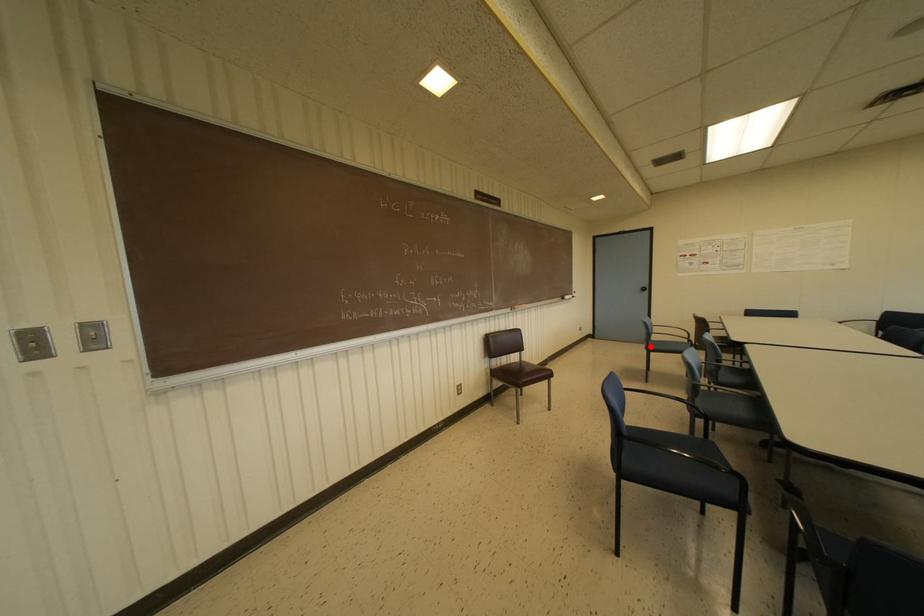
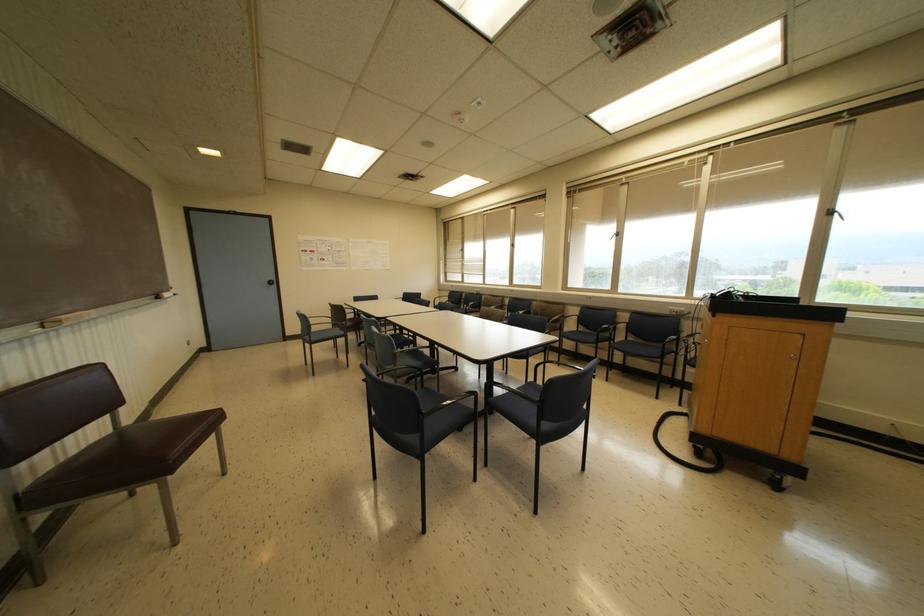
Question: I am providing you with two images of the same scene from different viewpoints. A red point is shown in image1. For the corresponding object point in image2, is it positioned nearer or farther from the camera?

Choices:
 (A) Nearer
 (B) Farther

Answer: (B)